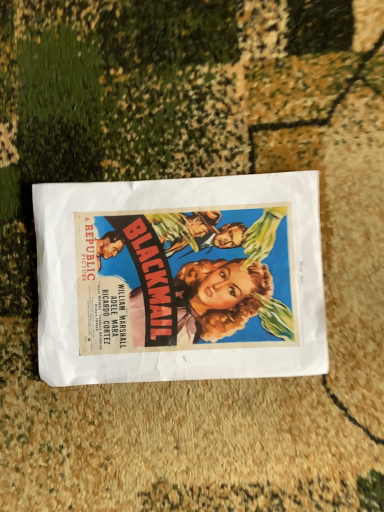
Where is `blank space above matte paper poster at center (from a real-world perspective)`? blank space above matte paper poster at center (from a real-world perspective) is located at coordinates (176, 279).